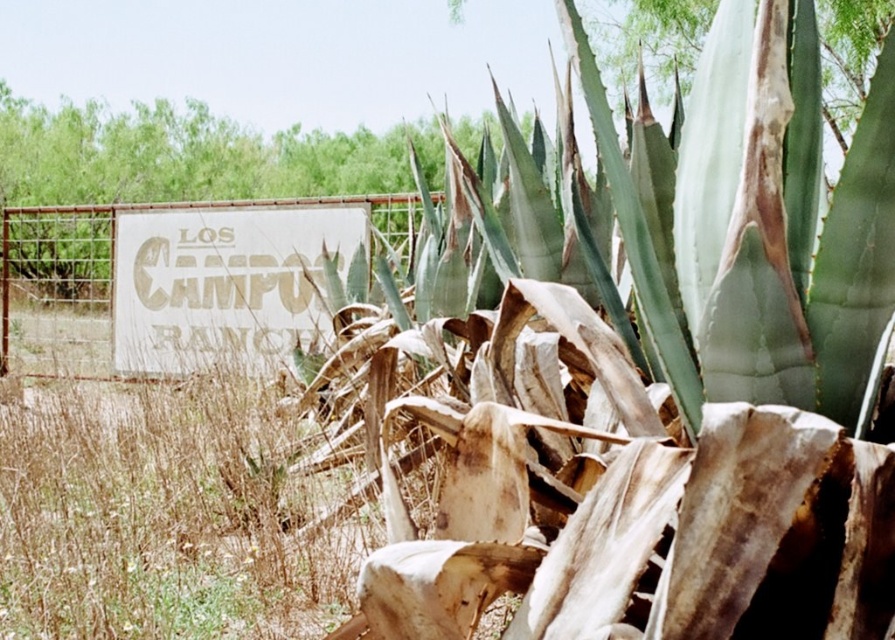
Which is in front, point (167, 264) or point (44, 289)?

Point (167, 264) is more forward.

Find the location of a particular element. white textured sign at center is located at coordinates (222, 282).

Identify the location of white textured sign at center. (222, 282).